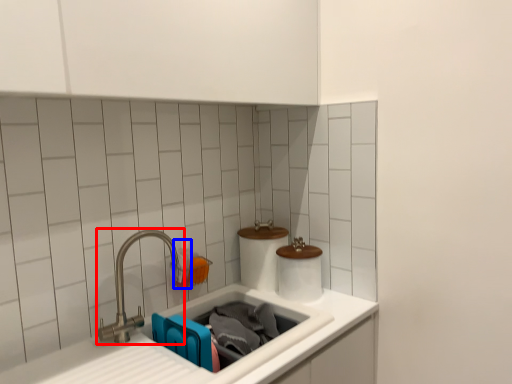
Question: Which of the following is the closest to the observer, tap (highlighted by a red box) or toiletry (highlighted by a blue box)?

Choices:
 (A) tap
 (B) toiletry

Answer: (A)